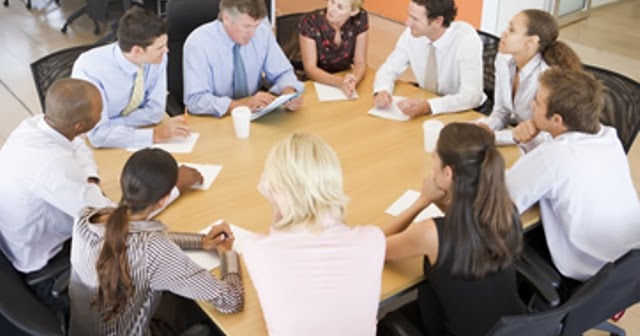
The height and width of the screenshot is (336, 640). Find the location of `sheets of paper`. sheets of paper is located at coordinates (184, 143), (208, 170), (244, 239), (399, 203), (387, 111), (329, 89), (272, 104).